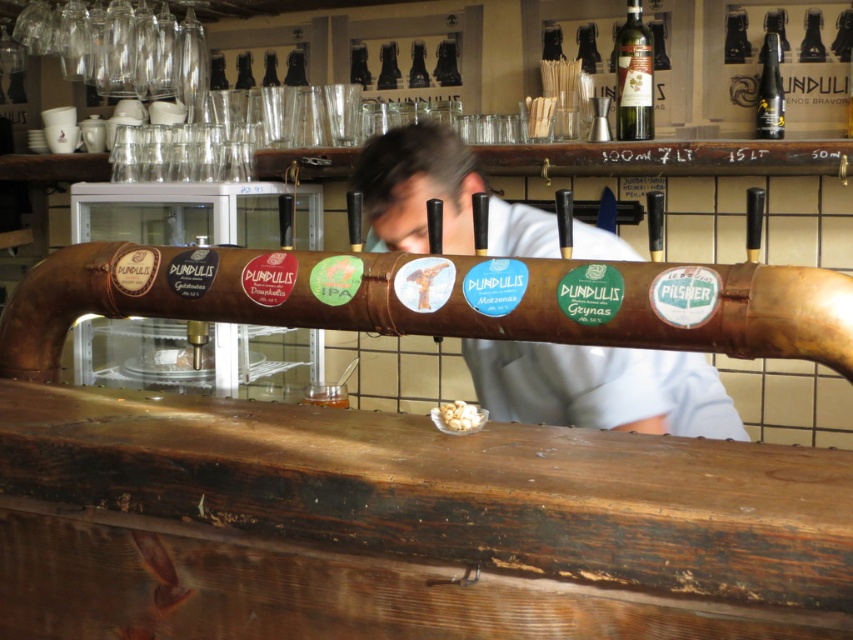
Question: Does white fabric shirt at center lie behind green glass bottle at upper right?

Choices:
 (A) no
 (B) yes

Answer: (A)

Question: Which point is farther to the camera?

Choices:
 (A) (630, 76)
 (B) (607, 371)

Answer: (A)

Question: Which point appears farthest from the camera in this image?

Choices:
 (A) (769, 136)
 (B) (422, 138)
 (C) (648, 128)

Answer: (C)

Question: Is green glass bottle at upper right to the right of shiny dark glass bottle at upper right from the viewer's perspective?

Choices:
 (A) yes
 (B) no

Answer: (B)

Question: Based on their relative distances, which object is nearer to the green glass bottle at upper right?

Choices:
 (A) white fabric shirt at center
 (B) shiny dark glass bottle at upper right

Answer: (B)

Question: Can you confirm if white fabric shirt at center is positioned to the left of shiny dark glass bottle at upper right?

Choices:
 (A) no
 (B) yes

Answer: (B)